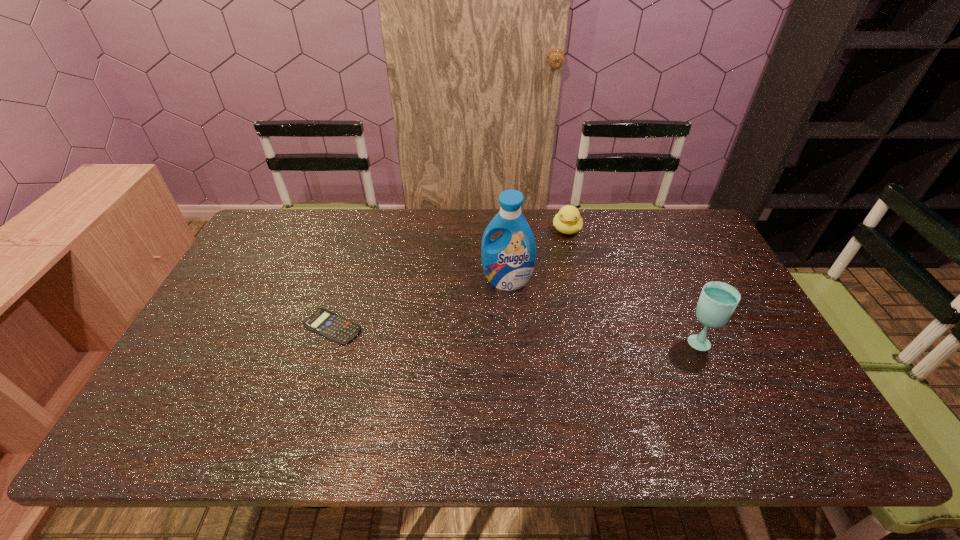
The width and height of the screenshot is (960, 540). Find the location of `vacant space at the left edge`. vacant space at the left edge is located at coordinates (243, 343).

Where is `blank space at the far left corner of the desktop`? The height and width of the screenshot is (540, 960). blank space at the far left corner of the desktop is located at coordinates (285, 217).

In the image, there is a desktop. Find the location of `free space at the far right corner`. free space at the far right corner is located at coordinates (651, 209).

This screenshot has height=540, width=960. In order to click on vacant space at the near right corner in this screenshot , I will do `click(768, 401)`.

The width and height of the screenshot is (960, 540). What are the coordinates of `empty space between the second object from left to right and the shortest object` in the screenshot? It's located at (420, 303).

Image resolution: width=960 pixels, height=540 pixels. What are the coordinates of `vacant area between the detergent and the leftmost object` in the screenshot? It's located at (420, 303).

This screenshot has height=540, width=960. I want to click on free space between the rightmost object and the calculator, so click(x=516, y=333).

The width and height of the screenshot is (960, 540). I want to click on empty space between the detergent and the leftmost object, so click(420, 303).

The width and height of the screenshot is (960, 540). I want to click on free area in between the rightmost object and the leftmost object, so click(x=516, y=333).

Identify the location of unoccupied position between the second object from left to right and the calculator. (420, 303).